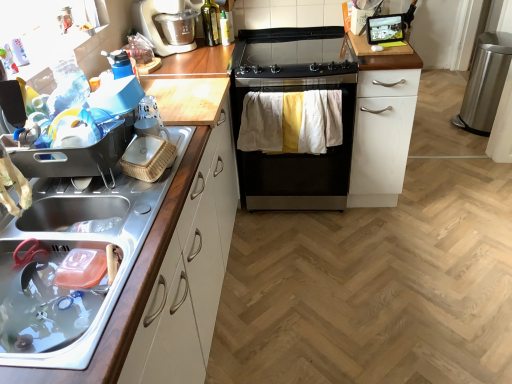
Where is `vacant space in front of black stainless steel stove at center`? vacant space in front of black stainless steel stove at center is located at coordinates (314, 247).